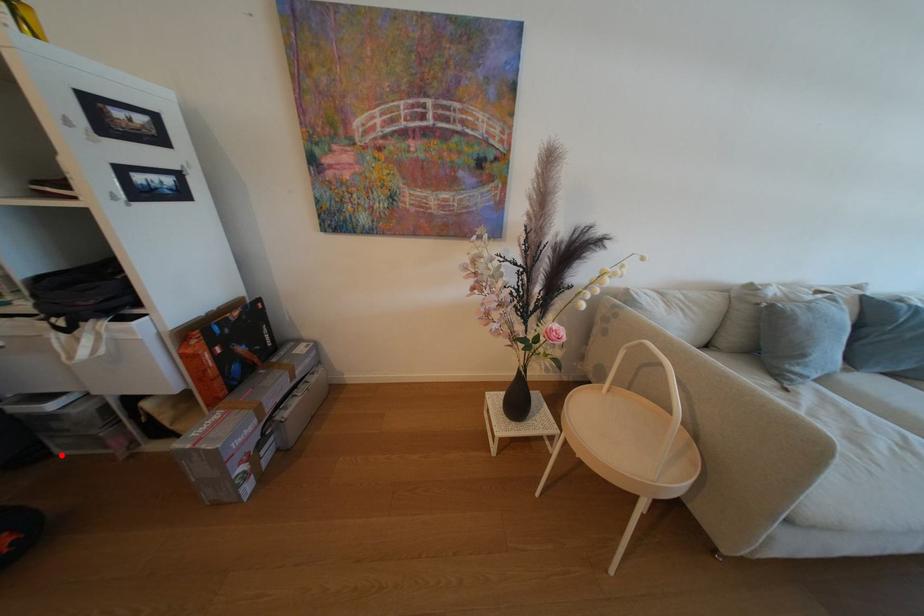
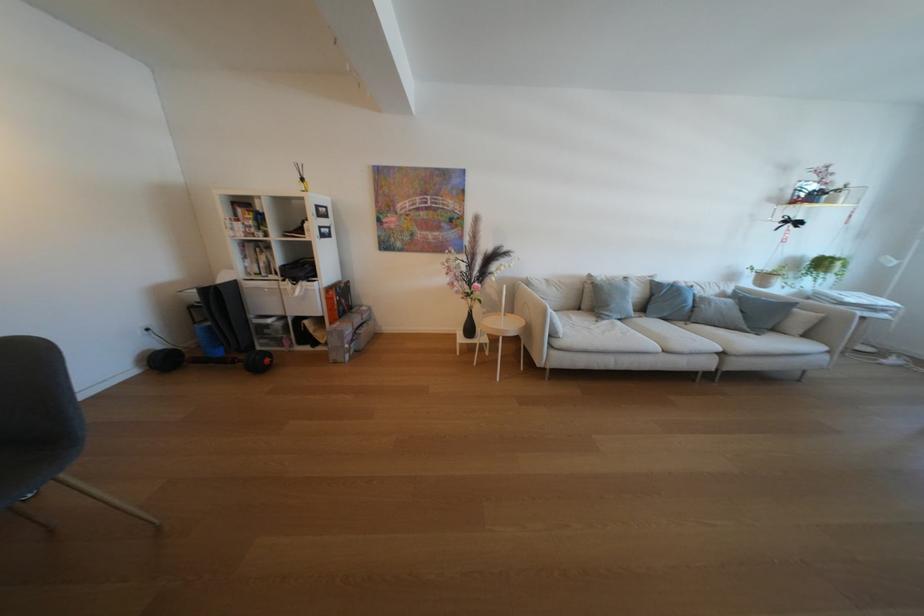
Find the pixel in the second image that matches the highlighted location in the first image.

(265, 351)